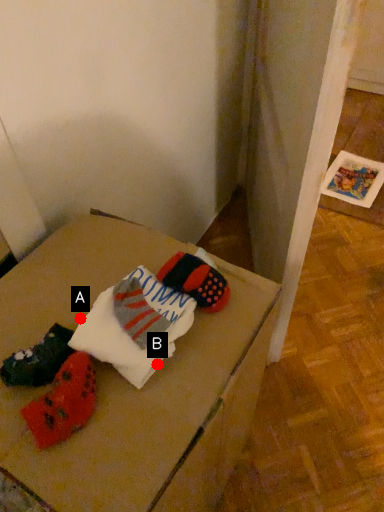
Question: Two points are circled on the image, labeled by A and B beside each circle. Which point is further to the camera?

Choices:
 (A) A is further
 (B) B is further

Answer: (A)